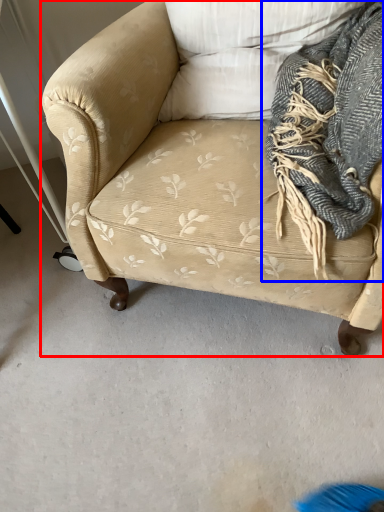
Question: Which of the following is the farthest to the observer, studio couch (highlighted by a red box) or scarf (highlighted by a blue box)?

Choices:
 (A) studio couch
 (B) scarf

Answer: (B)